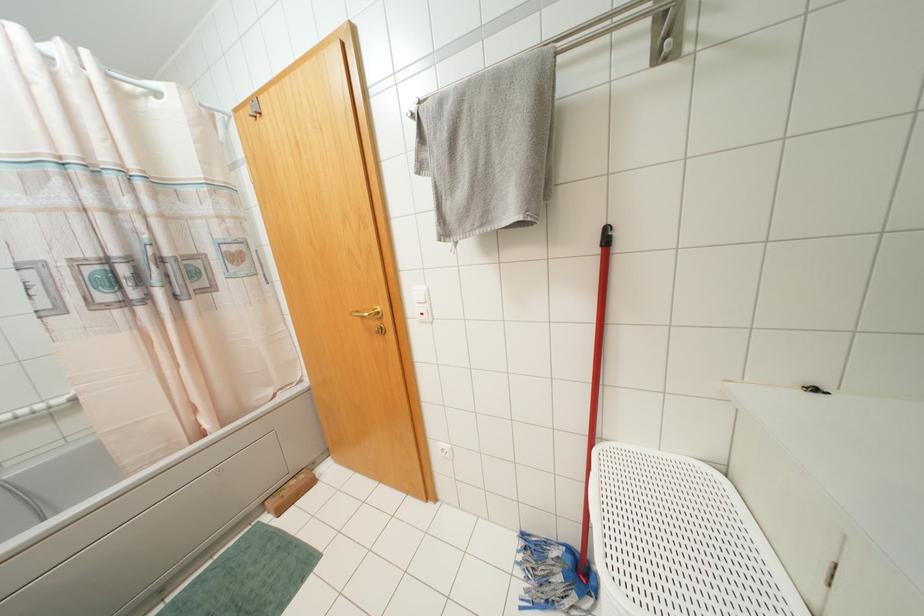
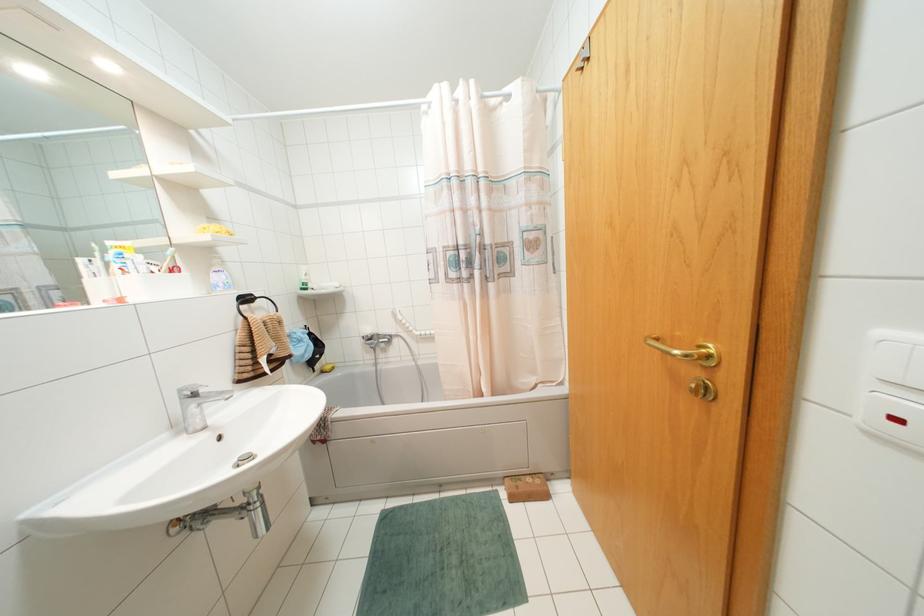
Question: How did the camera likely rotate?

Choices:
 (A) Left
 (B) Right
 (C) Up
 (D) Down

Answer: (A)